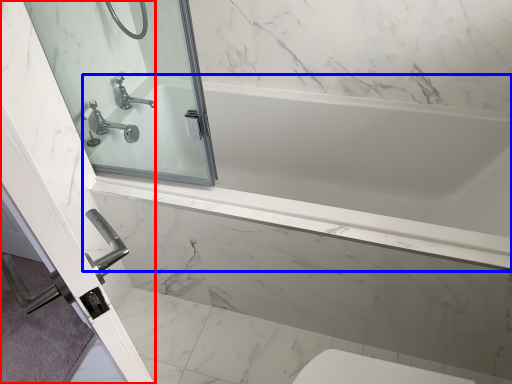
Question: Which point is further to the camera, screen door (highlighted by a red box) or bathtub (highlighted by a blue box)?

Choices:
 (A) screen door
 (B) bathtub

Answer: (B)